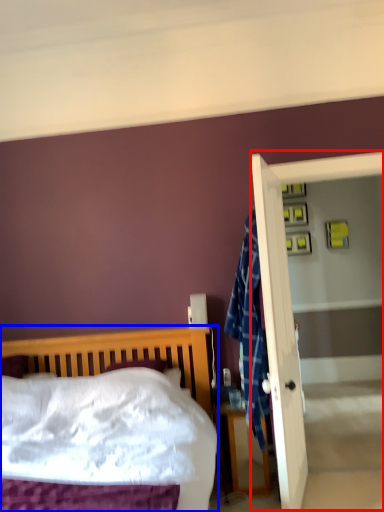
Question: Which of the following is the farthest to the observer, screen door (highlighted by a red box) or bed (highlighted by a blue box)?

Choices:
 (A) screen door
 (B) bed

Answer: (A)